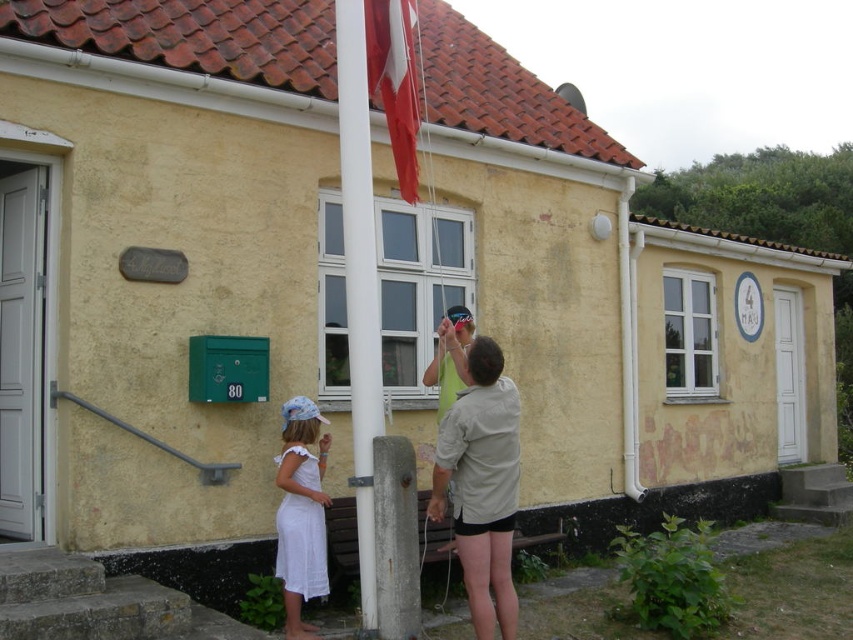
You are a photographer trying to capture a family photo. You need to position the two subjects so that the white cotton dress at lower left and the green fabric shirt at center are both visible in the frame. Based on their positions, which subject should you place on the left side of the photo?

The white cotton dress at lower left should be placed on the left side of the photo because it is already positioned to the left of the green fabric shirt at center.

You are standing in front of the building and see two people wearing shirts. One is wearing a light beige shirt at center and the other a green fabric shirt at center. Which shirt is closer to you?

The light beige shirt at center is closer to the viewer than the green fabric shirt at center.

You are standing at the point marked as point (x=300, y=513) in the image. What object are you currently standing on?

You are standing on the white cotton dress at lower left.